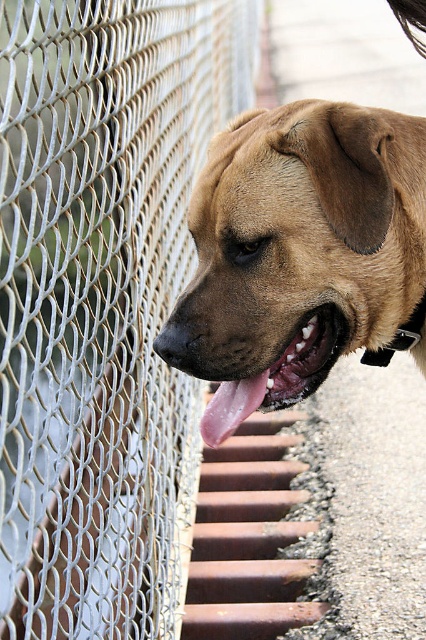
Between brown matte dog at center and pink glossy tongue at center, which one is positioned higher?

brown matte dog at center is above.

Is brown matte dog at center above pink glossy tongue at center?

Correct, brown matte dog at center is located above pink glossy tongue at center.

Which is in front, point (310, 230) or point (331, 364)?

Positioned in front is point (310, 230).

At what (x,y) coordinates should I click in order to perform the action: click on brown matte dog at center. Please return your answer as a coordinate pair (x, y). This screenshot has height=640, width=426. Looking at the image, I should click on (298, 252).

Measure the distance between point [143,625] and camera.

1.99 meters

Does silver mesh fence at left have a greater width compared to brown matte dog at center?

Correct, the width of silver mesh fence at left exceeds that of brown matte dog at center.

Does point (170, 96) come farther from viewer compared to point (324, 253)?

Yes, it is behind point (324, 253).

Identify the location of silver mesh fence at left. (103, 301).

The image size is (426, 640). Find the location of `silver mesh fence at left`. silver mesh fence at left is located at coordinates pos(103,301).

Is silver mesh fence at left positioned behind pink glossy tongue at center?

No, it is not.

Does point (54, 413) come behind point (325, 321)?

That is True.

The height and width of the screenshot is (640, 426). I want to click on silver mesh fence at left, so click(x=103, y=301).